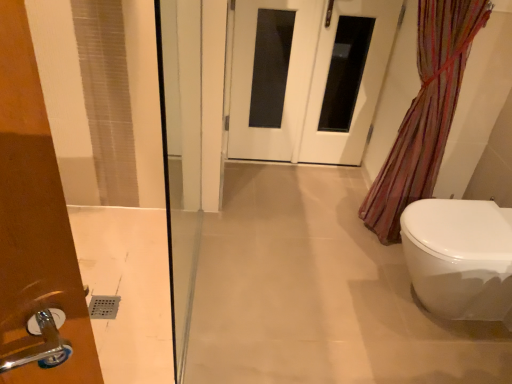
Question: Is translucent striped fabric at right bigger or smaller than white glossy door at center?

Choices:
 (A) big
 (B) small

Answer: (A)

Question: Would you say translucent striped fabric at right is inside or outside white glossy door at center?

Choices:
 (A) inside
 (B) outside

Answer: (B)

Question: Which object is positioned farthest from the translucent striped fabric at right?

Choices:
 (A) white glossy door at center
 (B) white glossy door at center
 (C) white glossy toilet at lower right

Answer: (B)

Question: Which is nearer to the white glossy door at center?

Choices:
 (A) translucent striped fabric at right
 (B) white glossy toilet at lower right
 (C) white glossy door at center

Answer: (C)